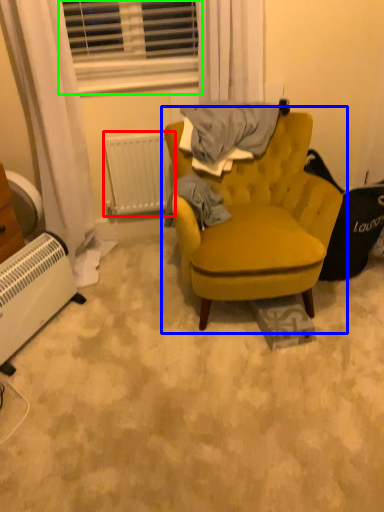
Question: Estimate the real-world distances between objects in this image. Which object is farther from radiator (highlighted by a red box), chair (highlighted by a blue box) or window (highlighted by a green box)?

Choices:
 (A) chair
 (B) window

Answer: (A)